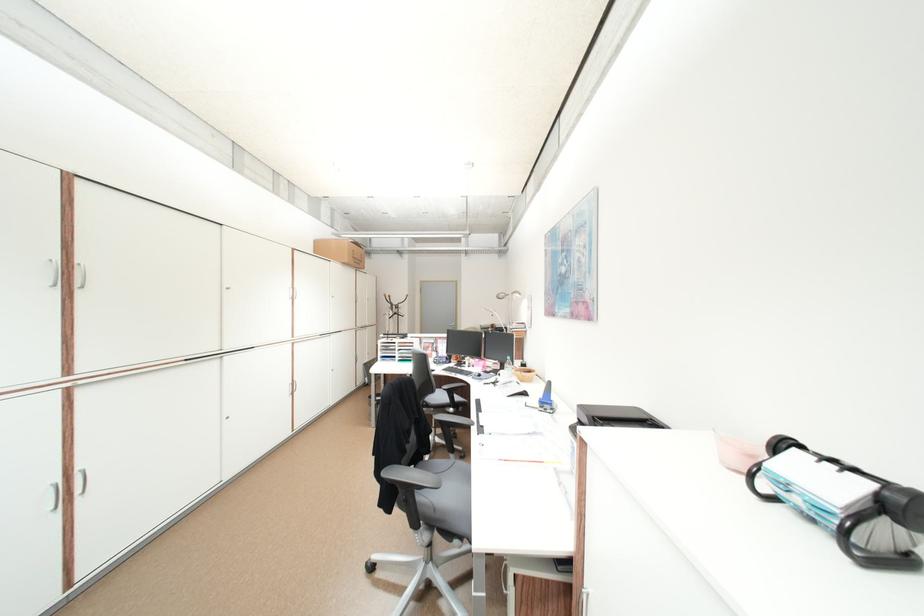
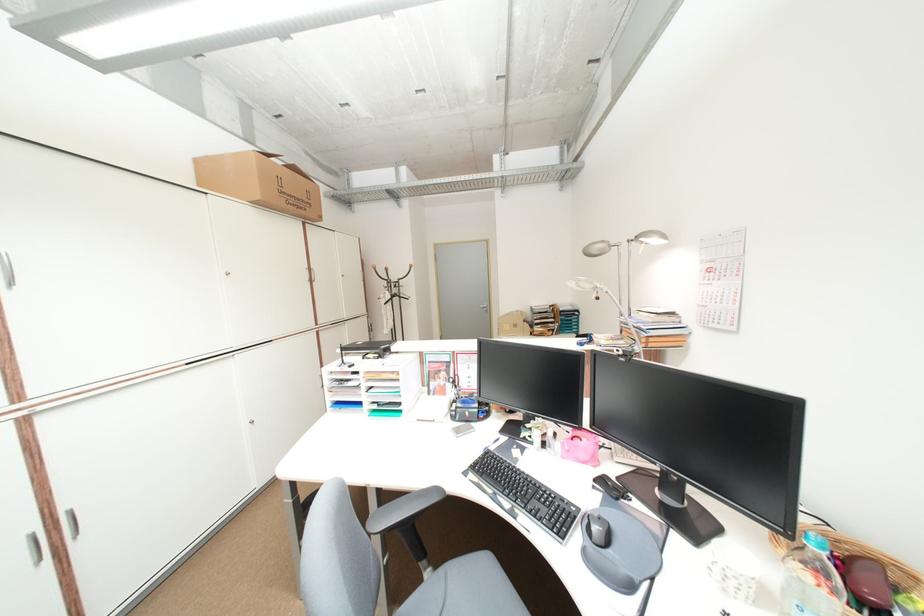
Question: Which direction would the cameraman need to move to produce the second image? Reply with the corresponding letter.

Choices:
 (A) Left
 (B) Right
 (C) Forward
 (D) Backward

Answer: (C)